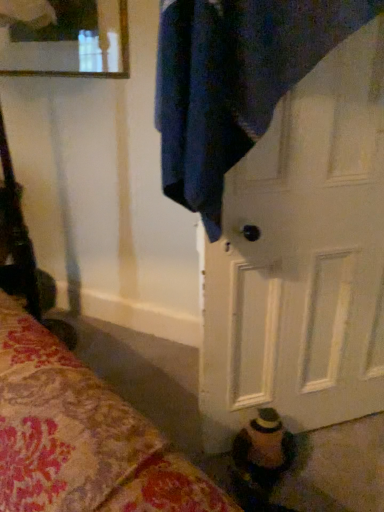
Where is `clear glass mirror at upper left`? The height and width of the screenshot is (512, 384). clear glass mirror at upper left is located at coordinates click(x=70, y=42).

Describe the element at coordinates (70, 42) in the screenshot. Image resolution: width=384 pixels, height=512 pixels. I see `clear glass mirror at upper left` at that location.

What is the approximate height of clear glass mirror at upper left?

The height of clear glass mirror at upper left is 12.46 inches.

Locate an element on the screen. Image resolution: width=384 pixels, height=512 pixels. white matte door at center is located at coordinates (302, 258).

What do you see at coordinates (302, 258) in the screenshot? I see `white matte door at center` at bounding box center [302, 258].

The image size is (384, 512). I want to click on clear glass mirror at upper left, so click(x=70, y=42).

Would you say white matte door at center is to the left or to the right of clear glass mirror at upper left in the picture?

white matte door at center is positioned on clear glass mirror at upper left's right side.

Is white matte door at center further to camera compared to clear glass mirror at upper left?

No, the depth of white matte door at center is less than that of clear glass mirror at upper left.

Between point (269, 127) and point (22, 32), which one is positioned in front?

The point (269, 127) is in front.

From the image's perspective, is white matte door at center above clear glass mirror at upper left?

Actually, white matte door at center appears below clear glass mirror at upper left in the image.

From a real-world perspective, which is physically below, white matte door at center or clear glass mirror at upper left?

white matte door at center, from a real-world perspective.

Considering the relative sizes of white matte door at center and clear glass mirror at upper left in the image provided, is white matte door at center thinner than clear glass mirror at upper left?

No, white matte door at center is not thinner than clear glass mirror at upper left.

In the scene shown: Between white matte door at center and clear glass mirror at upper left, which one has more height?

With more height is white matte door at center.

Consider the image. Considering the sizes of objects white matte door at center and clear glass mirror at upper left in the image provided, who is smaller, white matte door at center or clear glass mirror at upper left?

clear glass mirror at upper left.

Is white matte door at center not inside clear glass mirror at upper left?

Absolutely, white matte door at center is external to clear glass mirror at upper left.

Would you say white matte door at center is a long distance from clear glass mirror at upper left?

white matte door at center is positioned a significant distance from clear glass mirror at upper left.

Does white matte door at center turn towards clear glass mirror at upper left?

No.

Image resolution: width=384 pixels, height=512 pixels. What are the coordinates of `door that is under the clear glass mirror at upper left (from a real-world perspective)` in the screenshot? It's located at (302, 258).

Which object is positioned more to the right, clear glass mirror at upper left or white matte door at center?

Positioned to the right is white matte door at center.

Which object is closer to the camera, clear glass mirror at upper left or white matte door at center?

white matte door at center is more forward.

Between point (23, 68) and point (324, 359), which one is positioned in front?

The point (324, 359) is closer to the camera.

From the image's perspective, which one is positioned lower, clear glass mirror at upper left or white matte door at center?

white matte door at center.

Based on the photo, from a real-world perspective, relative to white matte door at center, is clear glass mirror at upper left vertically above or below?

From a real-world perspective, clear glass mirror at upper left is physically above white matte door at center.

Can you confirm if clear glass mirror at upper left is thinner than white matte door at center?

Yes.

Considering the sizes of clear glass mirror at upper left and white matte door at center in the image, is clear glass mirror at upper left taller or shorter than white matte door at center?

In the image, clear glass mirror at upper left appears to be shorter than white matte door at center.

In terms of size, does clear glass mirror at upper left appear bigger or smaller than white matte door at center?

Clearly, clear glass mirror at upper left is smaller in size than white matte door at center.

Is clear glass mirror at upper left outside of white matte door at center?

clear glass mirror at upper left is positioned outside white matte door at center.

Is clear glass mirror at upper left next to white matte door at center?

No, clear glass mirror at upper left is not making contact with white matte door at center.

Is clear glass mirror at upper left aimed at white matte door at center?

No.

How many degrees apart are the facing directions of clear glass mirror at upper left and white matte door at center?

The angular difference between clear glass mirror at upper left and white matte door at center is 42.7 degrees.

I want to click on mirror behind the white matte door at center, so click(70, 42).

Locate an element on the screen. The height and width of the screenshot is (512, 384). door below the clear glass mirror at upper left (from a real-world perspective) is located at coordinates (302, 258).

In order to click on door below the clear glass mirror at upper left (from the image's perspective) in this screenshot , I will do `click(302, 258)`.